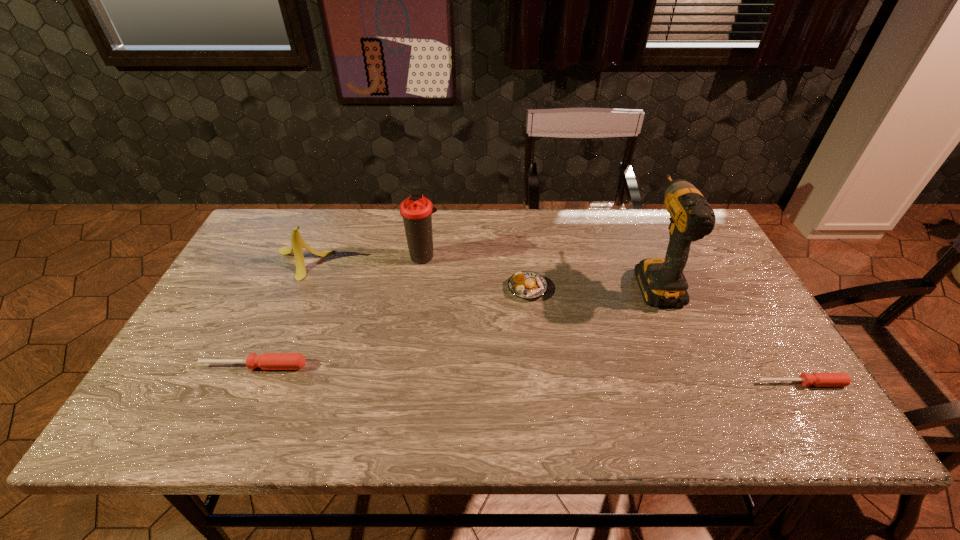
Locate an element on the screen. The width and height of the screenshot is (960, 540). banana that is at the far edge is located at coordinates (298, 243).

Image resolution: width=960 pixels, height=540 pixels. I want to click on screwdriver located at the left edge, so click(267, 361).

Find the location of `banana that is at the left edge`. banana that is at the left edge is located at coordinates (298, 243).

Where is `object situated at the right edge`? This screenshot has width=960, height=540. object situated at the right edge is located at coordinates (817, 379).

At what (x,y) coordinates should I click in order to perform the action: click on object that is at the far left corner. Please return your answer as a coordinate pair (x, y). The width and height of the screenshot is (960, 540). Looking at the image, I should click on (298, 243).

Where is `object that is at the near left corner`? The width and height of the screenshot is (960, 540). object that is at the near left corner is located at coordinates (267, 361).

This screenshot has height=540, width=960. In order to click on object that is at the near right corner in this screenshot , I will do `click(817, 379)`.

In the image, there is a desktop. Where is `vacant space at the far edge`? vacant space at the far edge is located at coordinates (538, 242).

Locate an element on the screen. vacant space at the near edge of the desktop is located at coordinates (550, 373).

Find the location of a particular element. The image size is (960, 540). free space at the left edge is located at coordinates (200, 342).